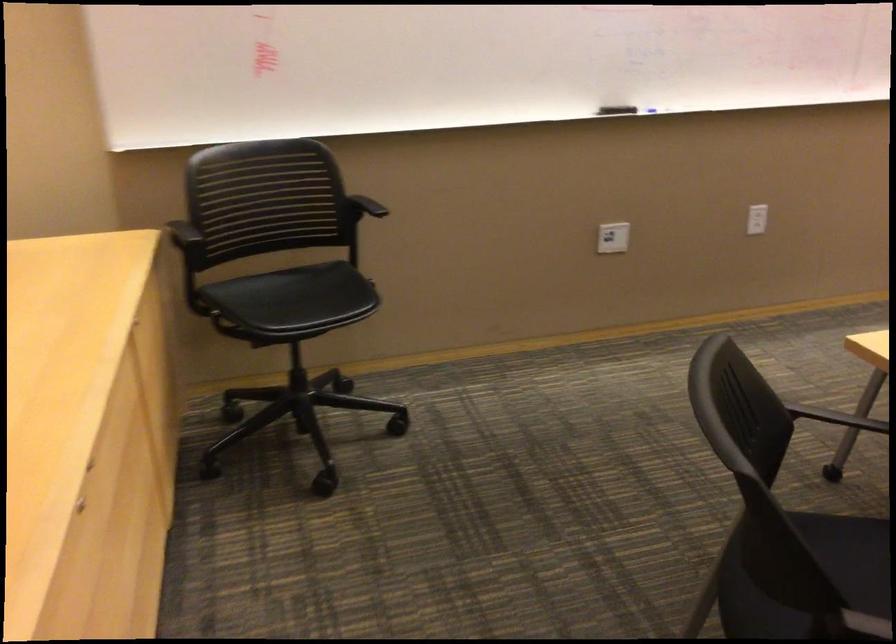
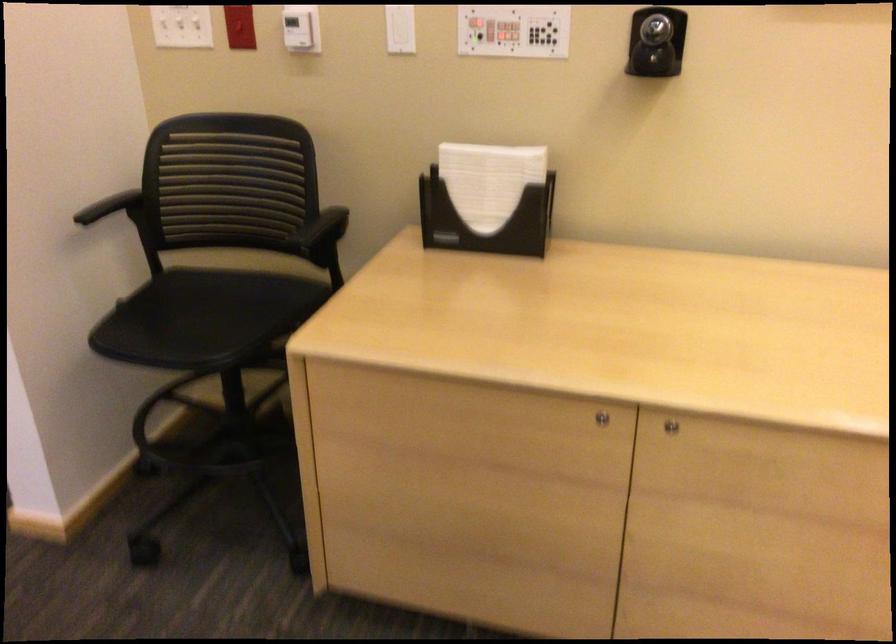
Locate, in the second image, the point that corresponds to (117,542) in the first image.

(670, 426)